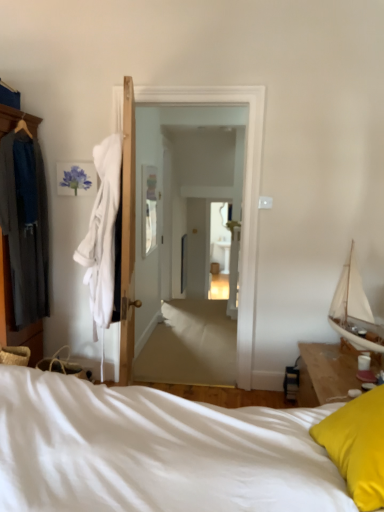
Question: Would you say white soft robe at left is to the left or to the right of white soft bed at lower right in the picture?

Choices:
 (A) left
 (B) right

Answer: (A)

Question: Looking at the image, does white soft robe at left seem bigger or smaller compared to white soft bed at lower right?

Choices:
 (A) small
 (B) big

Answer: (A)

Question: Based on their relative distances, which object is nearer to the yellow fabric pillow at lower right?

Choices:
 (A) white glossy door at center
 (B) dark gray fabric robe at left
 (C) white sailboat at right
 (D) white soft robe at left
 (E) white soft bed at lower right

Answer: (E)

Question: Which object is positioned farthest from the white soft bed at lower right?

Choices:
 (A) yellow fabric pillow at lower right
 (B) dark gray fabric robe at left
 (C) white soft robe at left
 (D) white glossy door at center
 (E) white sailboat at right

Answer: (D)